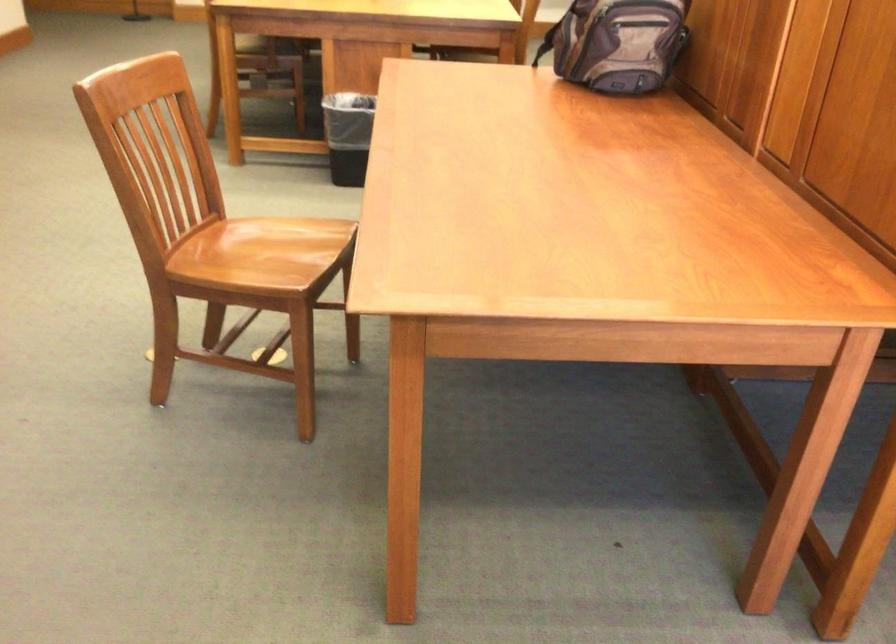
Where would you pull the backpack handle? Please return your answer as a coordinate pair (x, y).

(582, 15)